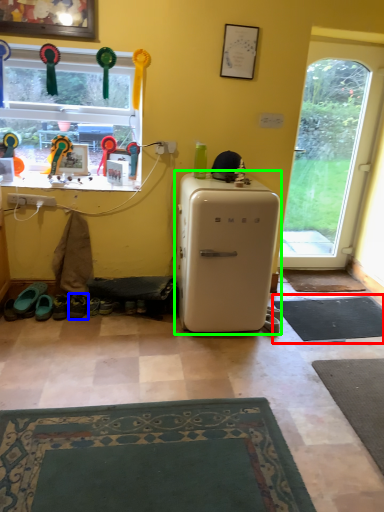
Question: Estimate the real-world distances between objects in this image. Which object is closer to doormat (highlighted by a red box), footwear (highlighted by a blue box) or refrigerator (highlighted by a green box)?

Choices:
 (A) footwear
 (B) refrigerator

Answer: (B)